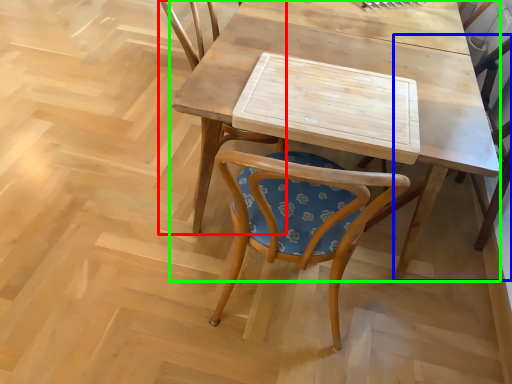
Question: Which object is the closest to the chair (highlighted by a red box)? Choose among these: chair (highlighted by a blue box) or table (highlighted by a green box).

Choices:
 (A) chair
 (B) table

Answer: (B)